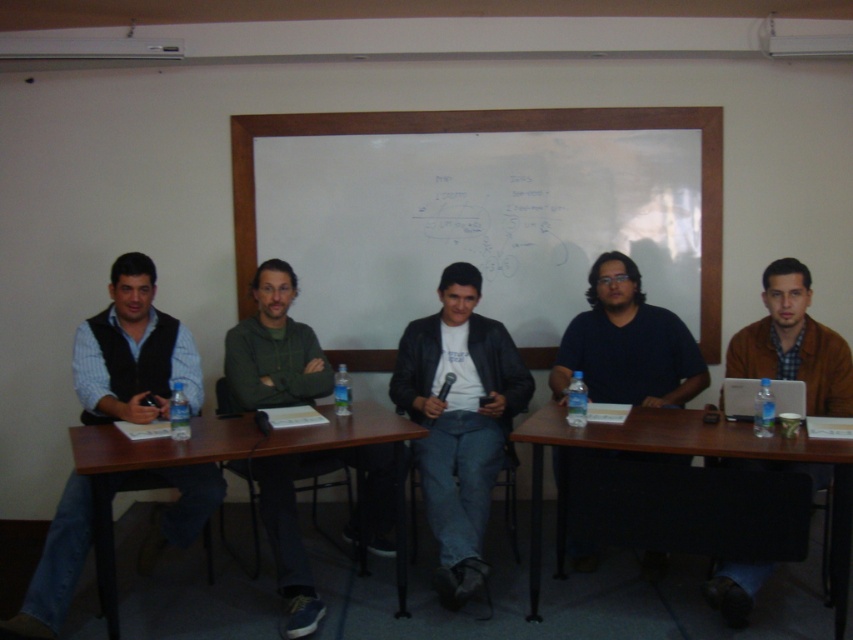
Question: Which of the following is the closest to the observer?

Choices:
 (A) white matte board at center
 (B) black leather jacket at center
 (C) brown leather jacket at right
 (D) matte black vest at left

Answer: (D)

Question: Does dark blue shirt at center lie behind matte black laptop at right?

Choices:
 (A) yes
 (B) no

Answer: (A)

Question: Estimate the real-world distances between objects in this image. Which object is closer to the brown leather jacket at right?

Choices:
 (A) dark blue shirt at center
 (B) white matte board at center
 (C) whiteboard at center
 (D) black leather jacket at center

Answer: (A)

Question: Does whiteboard at center appear under brown wooden table at lower right?

Choices:
 (A) yes
 (B) no

Answer: (B)

Question: Which point is farther to the camera?

Choices:
 (A) (438, 400)
 (B) (744, 404)

Answer: (A)

Question: Where is dark blue shirt at center located in relation to matte black laptop at right in the image?

Choices:
 (A) below
 (B) above

Answer: (B)